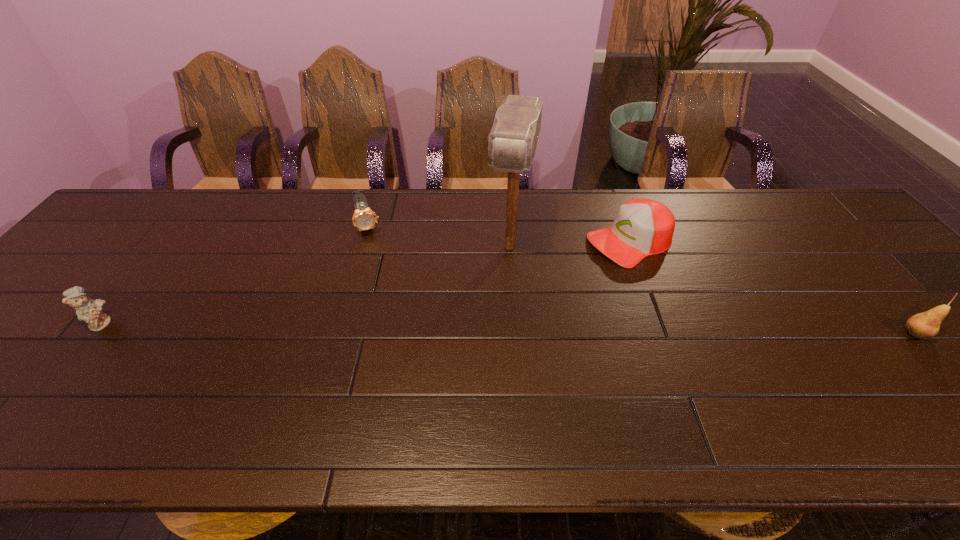
You are a GUI agent. You are given a task and a screenshot of the screen. Output one action in this format:
    pyautogui.click(x=<x>, y=<y>)
    Task: Click on the vacant space that satisfies the following two spatial constraints: 1. on the front side of the pear; 2. on the left side of the third object from left to right
    
    Given the screenshot: What is the action you would take?
    pyautogui.click(x=516, y=334)